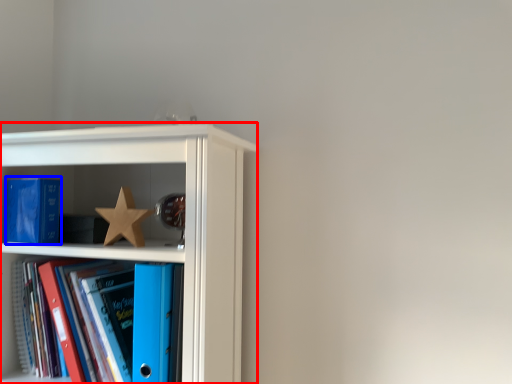
Question: Among these objects, which one is nearest to the camera, shelf (highlighted by a red box) or paperback book (highlighted by a blue box)?

Choices:
 (A) shelf
 (B) paperback book

Answer: (A)